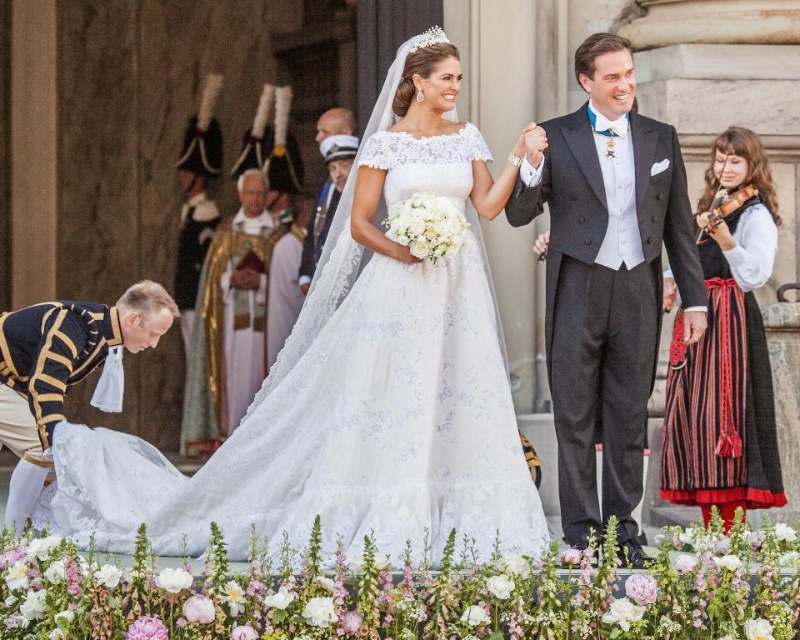
Question: Considering the relative positions of smooth black suit at upper right and black woven skirt at right in the image provided, where is smooth black suit at upper right located with respect to black woven skirt at right?

Choices:
 (A) left
 (B) right

Answer: (A)

Question: Which object is positioned farthest from the smooth black suit at upper right?

Choices:
 (A) black woven skirt at right
 (B) white lace dress at center

Answer: (B)

Question: Does white lace dress at center have a greater width compared to black woven skirt at right?

Choices:
 (A) yes
 (B) no

Answer: (A)

Question: Among these objects, which one is nearest to the camera?

Choices:
 (A) smooth black suit at upper right
 (B) white lace dress at center

Answer: (B)

Question: Estimate the real-world distances between objects in this image. Which object is farther from the black woven skirt at right?

Choices:
 (A) white lace dress at center
 (B) smooth black suit at upper right

Answer: (A)

Question: From the image, what is the correct spatial relationship of white lace dress at center in relation to black woven skirt at right?

Choices:
 (A) below
 (B) above

Answer: (A)